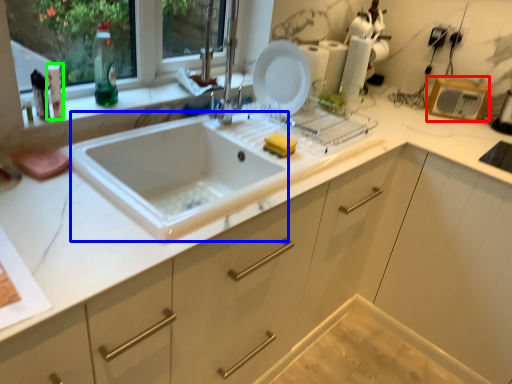
Question: Based on their relative distances, which object is farther from appliance (highlighted by a red box)? Choose from sink (highlighted by a blue box) and bottle (highlighted by a green box).

Choices:
 (A) sink
 (B) bottle

Answer: (B)